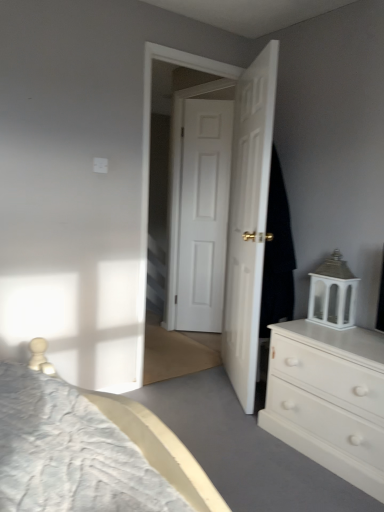
Locate an element on the screen. vacant area that is in front of white glossy door at center, placed as the 2th door when sorted from back to front is located at coordinates (221, 423).